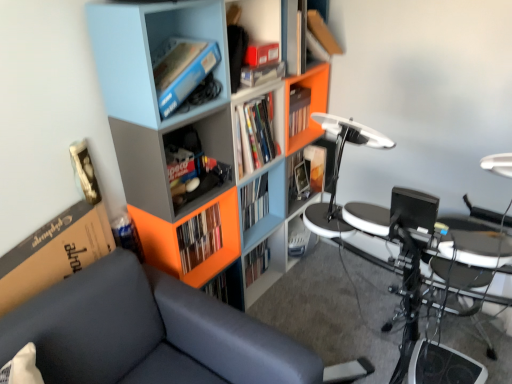
Locate an element on the screen. vacant point above metallic silver drum set at lower right (from a real-world perspective) is located at coordinates (344, 312).